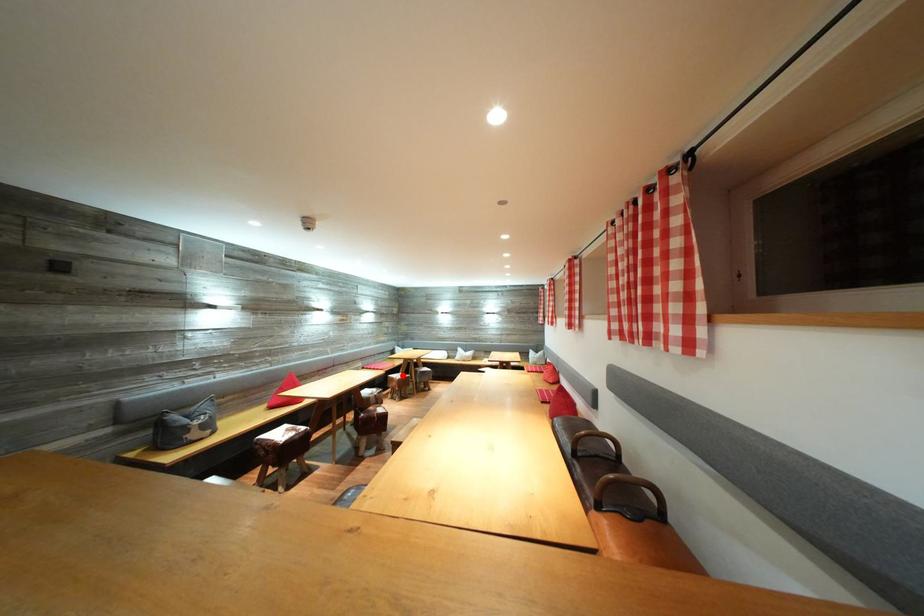
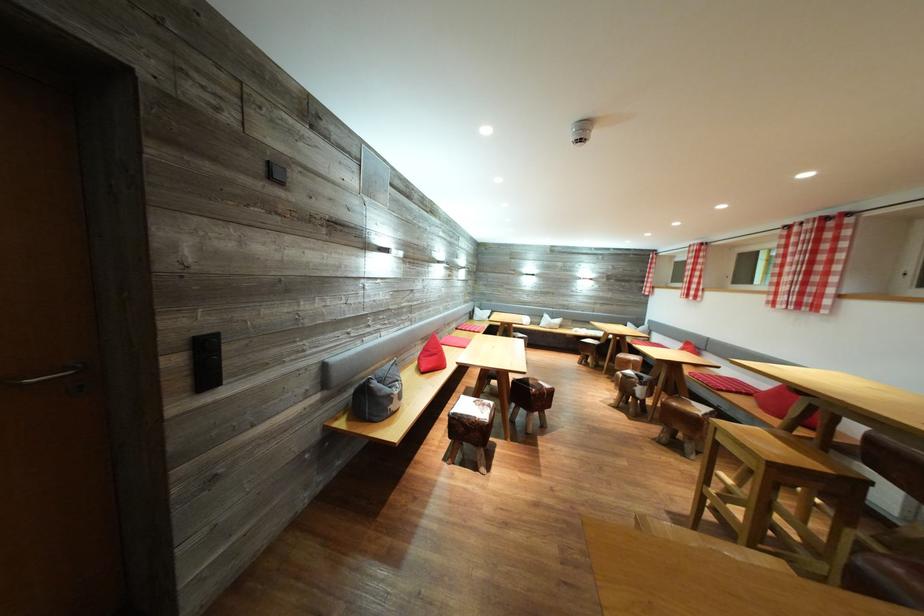
Question: I am providing you with two images of the same scene from different viewpoints. A red point is marked on the first image. At the location where the point appears in image 1, is it still visible in image 2?

Choices:
 (A) Yes
 (B) No

Answer: (B)